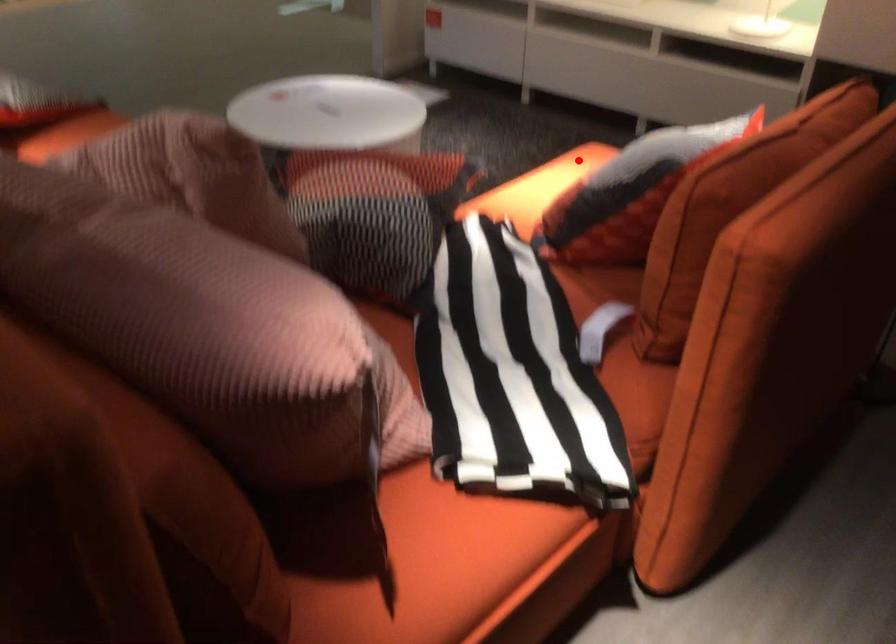
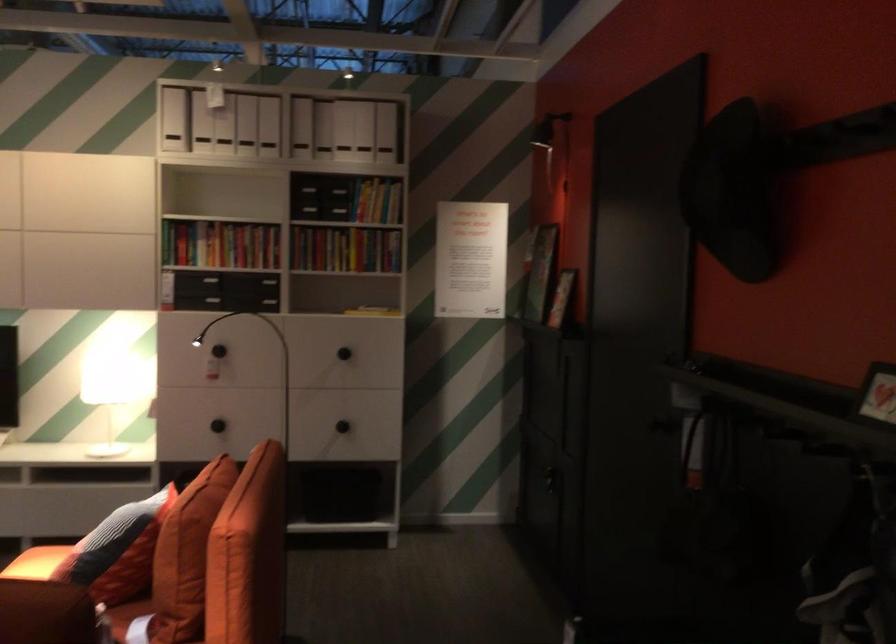
Question: I am providing you with two images of the same scene from different viewpoints. A red point is marked on the first image. Can you still see the location of the red point in image 2?

Choices:
 (A) Yes
 (B) No

Answer: (A)